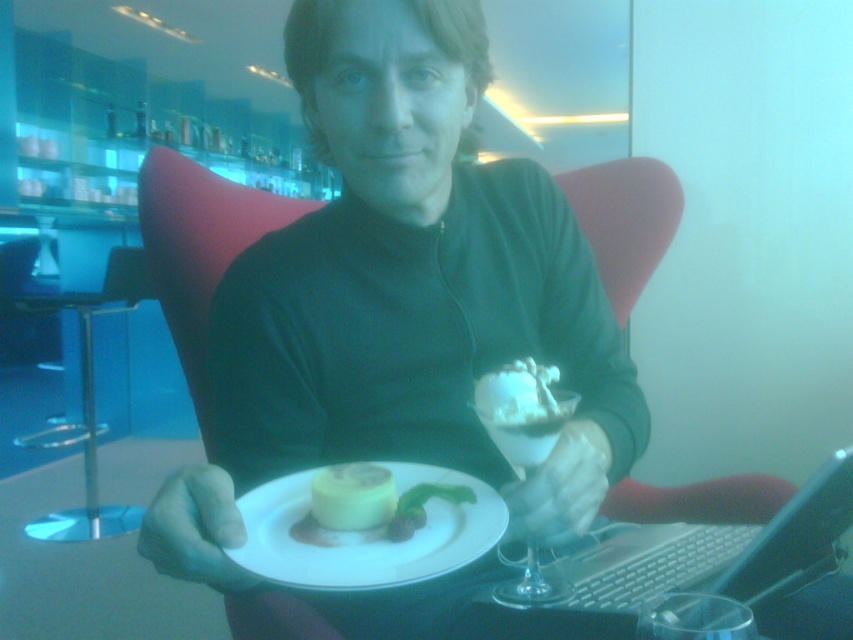
Is white ceramic plate at center smaller than white creamy dessert at center?

No, white ceramic plate at center is not smaller than white creamy dessert at center.

Does white ceramic plate at center have a lesser height compared to white creamy dessert at center?

Indeed, white ceramic plate at center has a lesser height compared to white creamy dessert at center.

Does point (296, 504) lie behind point (531, 368)?

No, it is not.

Identify the location of white ceramic plate at center. (367, 532).

Can you confirm if transparent plastic table at left is positioned below clear glass dessert cup at center?

Yes, transparent plastic table at left is below clear glass dessert cup at center.

Can you confirm if transparent plastic table at left is wider than clear glass dessert cup at center?

Correct, the width of transparent plastic table at left exceeds that of clear glass dessert cup at center.

Is point (88, 460) positioned after point (546, 392)?

Yes, point (88, 460) is behind point (546, 392).

You are a GUI agent. You are given a task and a screenshot of the screen. Output one action in this format:
    pyautogui.click(x=<x>, y=<y>)
    Task: Click on the transparent plastic table at left
    
    Given the screenshot: What is the action you would take?
    pyautogui.click(x=83, y=420)

Does white ceramic plate at center appear on the left side of yellow creamy cake at center?

In fact, white ceramic plate at center is to the right of yellow creamy cake at center.

From the picture: Between white ceramic plate at center and yellow creamy cake at center, which one has less height?

yellow creamy cake at center is shorter.

Where is `white ceramic plate at center`? The image size is (853, 640). white ceramic plate at center is located at coordinates (367, 532).